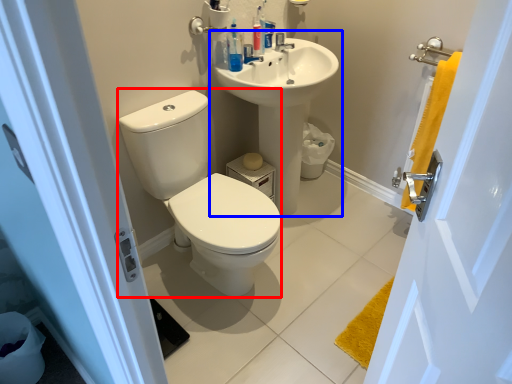
Question: Which of the following is the farthest to the observer, sit (highlighted by a red box) or sink (highlighted by a blue box)?

Choices:
 (A) sit
 (B) sink

Answer: (B)